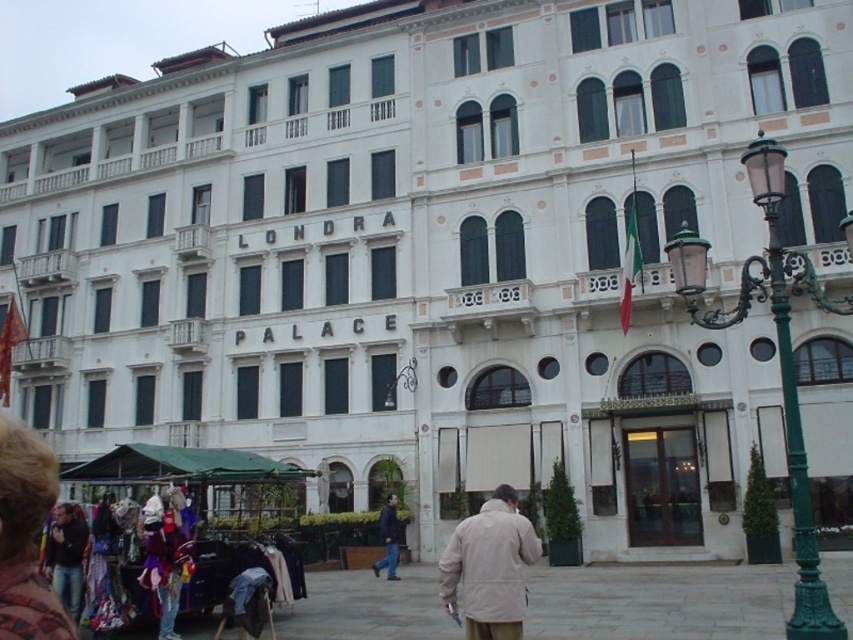
You are standing at the entrance of the LONDRA PALACE building and want to walk straight ahead towards the street. Which object will you encounter first, the green wrought iron lamp post at center right or the vendor stall on the left?

The green wrought iron lamp post at center right is at point (x=778, y=356), so it is closer to the entrance than the vendor stall on the left. Therefore, you will encounter the green wrought iron lamp post at center right first.

You are standing at the entrance of LONDRA PALACE and want to find the green wrought iron lamp post at center right. According to the scene description, where exactly is the lamp post located?

The green wrought iron lamp post at center right is located at point (778, 356).

You are standing at the entrance of the LONDRA PALACE building and want to find the green wrought iron lamp post at center right. According to the scene description, where should you look relative to your position?

The green wrought iron lamp post at center right is located at point 0.559 on the horizontal axis and 0.913 on the vertical axis relative to your position at the entrance.